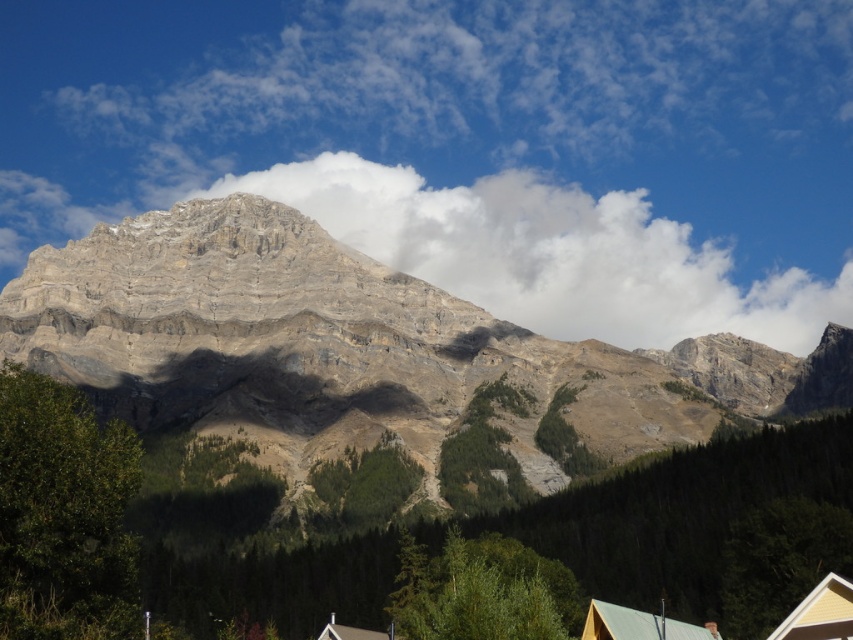
Is rocky mountain range at center shorter than white fluffy cloud at upper center?

No, rocky mountain range at center is not shorter than white fluffy cloud at upper center.

Between point (556, 349) and point (86, 227), which one is positioned behind?

Positioned behind is point (86, 227).

Where is `rocky mountain range at center`? rocky mountain range at center is located at coordinates (360, 374).

Does rocky mountain range at center appear over brown wooden hut at lower center?

Correct, rocky mountain range at center is located above brown wooden hut at lower center.

Image resolution: width=853 pixels, height=640 pixels. Identify the location of rocky mountain range at center. (360, 374).

Looking at this image, who is shorter, white fluffy cloud at upper center or brown wooden hut at lower center?

Standing shorter between the two is brown wooden hut at lower center.

Does white fluffy cloud at upper center have a larger size compared to brown wooden hut at lower center?

Yes.

At what (x,y) coordinates should I click in order to perform the action: click on white fluffy cloud at upper center. Please return your answer as a coordinate pair (x, y). This screenshot has height=640, width=853. Looking at the image, I should click on (550, 253).